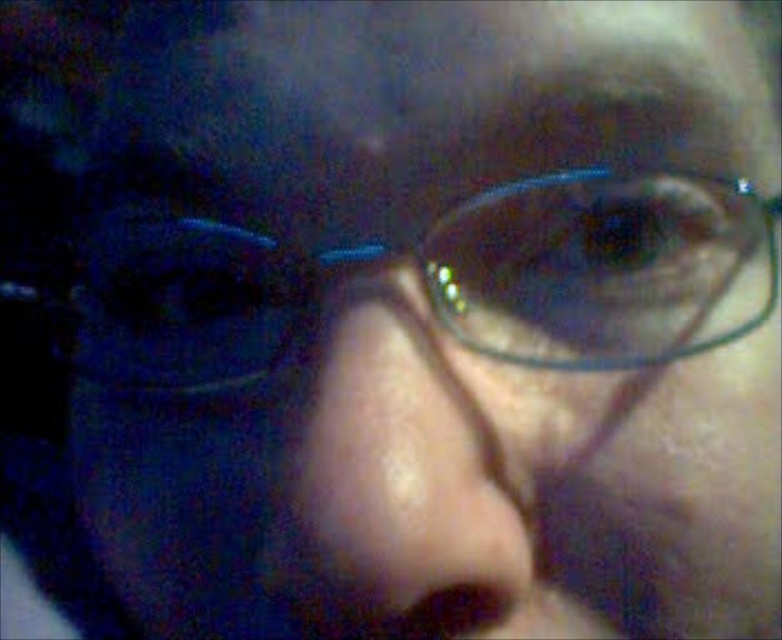
You are a photographer trying to adjust the lighting for a portrait. You notice the clear plastic glasses at center and the smooth skin nose at center in the image. Based on their positions, which object is closer to the top of the frame?

The clear plastic glasses at center are located above the smooth skin nose at center, so they are closer to the top of the frame.

You are a photographer trying to adjust the focus on a camera. The subject has clear plastic glasses at center in the image. Where should you focus to ensure the glasses are sharp?

You should focus at the point where the clear plastic glasses at center are located, which is at coordinates [601,268], to ensure they appear sharp in the final image.